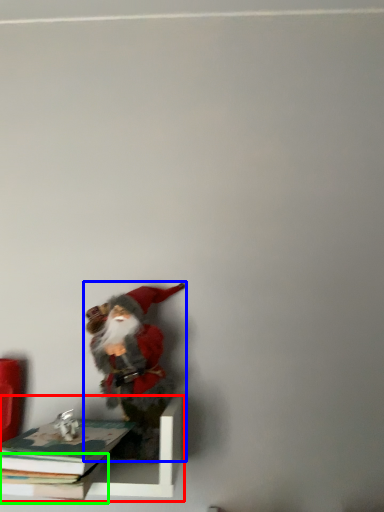
Question: Considering the real-world distances, which object is closest to shelf (highlighted by a red box)? person (highlighted by a blue box) or book (highlighted by a green box).

Choices:
 (A) person
 (B) book

Answer: (B)